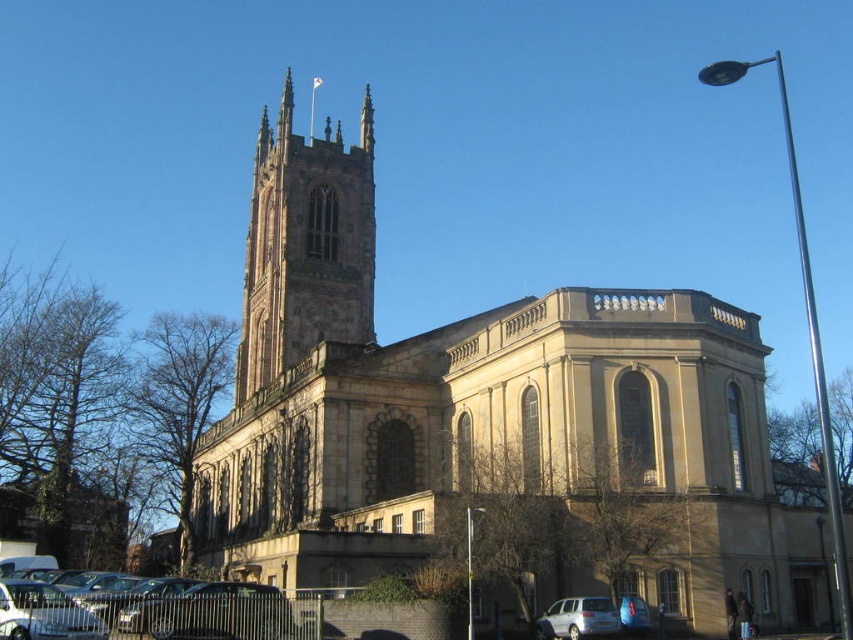
Who is taller, brown stone tower at center-left or silver metallic car at lower left?

Standing taller between the two is brown stone tower at center-left.

From the picture: Is the position of brown stone tower at center-left more distant than that of silver metallic car at lower left?

Yes, brown stone tower at center-left is behind silver metallic car at lower left.

The width and height of the screenshot is (853, 640). I want to click on brown stone tower at center-left, so click(305, 244).

The height and width of the screenshot is (640, 853). In order to click on brown stone tower at center-left in this screenshot , I will do `click(305, 244)`.

Who is higher up, brown stone tower at center-left or silver metallic car at lower right?

brown stone tower at center-left is above.

Who is more forward, (289, 189) or (570, 605)?

Point (570, 605) is in front.

Identify the location of brown stone tower at center-left. The height and width of the screenshot is (640, 853). pyautogui.click(x=305, y=244).

Is brown stone church at center positioned at the back of silver metallic car at lower left?

No, it is not.

Between brown stone church at center and silver metallic car at lower left, which one appears on the right side from the viewer's perspective?

Positioned to the right is brown stone church at center.

Does point (277, 134) lie behind point (155, 627)?

Yes.

Locate an element on the screen. This screenshot has width=853, height=640. brown stone church at center is located at coordinates (476, 403).